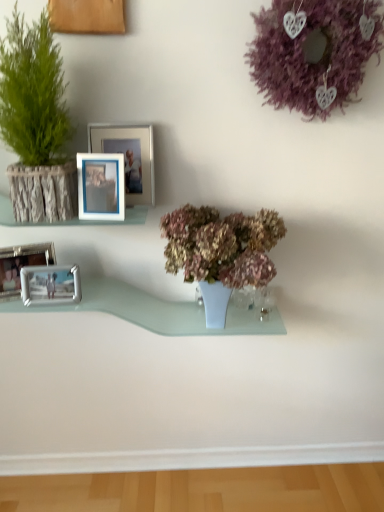
Question: Based on their positions, is wooden frame at left located to the left or right of blue plastic picture frame at upper center, acting as the 4th picture frame starting from the left?

Choices:
 (A) left
 (B) right

Answer: (A)

Question: Is wooden frame at left spatially inside blue plastic picture frame at upper center, the 1th picture frame positioned from the right, or outside of it?

Choices:
 (A) inside
 (B) outside

Answer: (B)

Question: Which of these objects is positioned farthest from the clear glass shelf at center?

Choices:
 (A) dry matte flowers at center, which appears as the 2th houseplant when viewed from the top
 (B) wooden frame at left
 (C) metallic silver picture frame at lower left, which is counted as the first picture frame, starting from the left
 (D) blue plastic picture frame at upper center, acting as the 4th picture frame starting from the left
 (E) green textured plant at left, the first houseplant when ordered from left to right

Answer: (E)

Question: Based on their relative distances, which object is farther from the dry matte flowers at center, which appears as the 2th houseplant when viewed from the top?

Choices:
 (A) green textured plant at left, the first houseplant when ordered from top to bottom
 (B) clear glass shelf at center
 (C) metallic silver picture frame at left, the second picture frame when ordered from left to right
 (D) metallic silver picture frame at lower left, which is counted as the first picture frame, starting from the left
 (E) blue plastic picture frame at upper center, the 1th picture frame positioned from the right

Answer: (D)